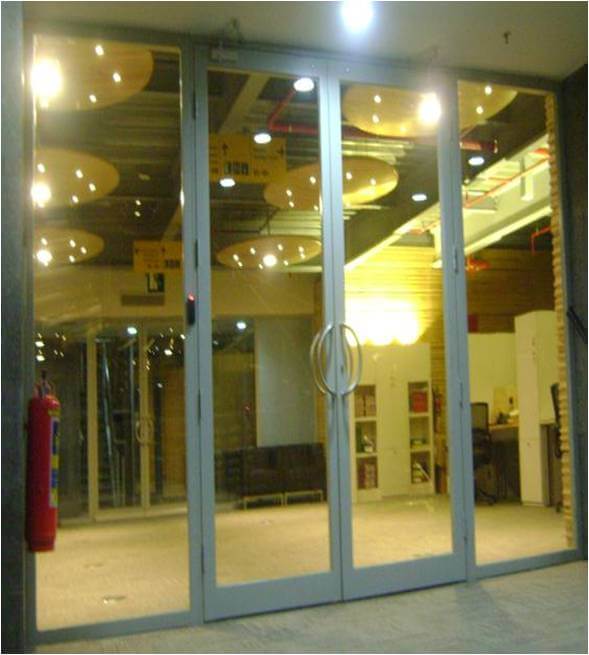
The image size is (589, 655). I want to click on ceiling, so click(x=157, y=132).